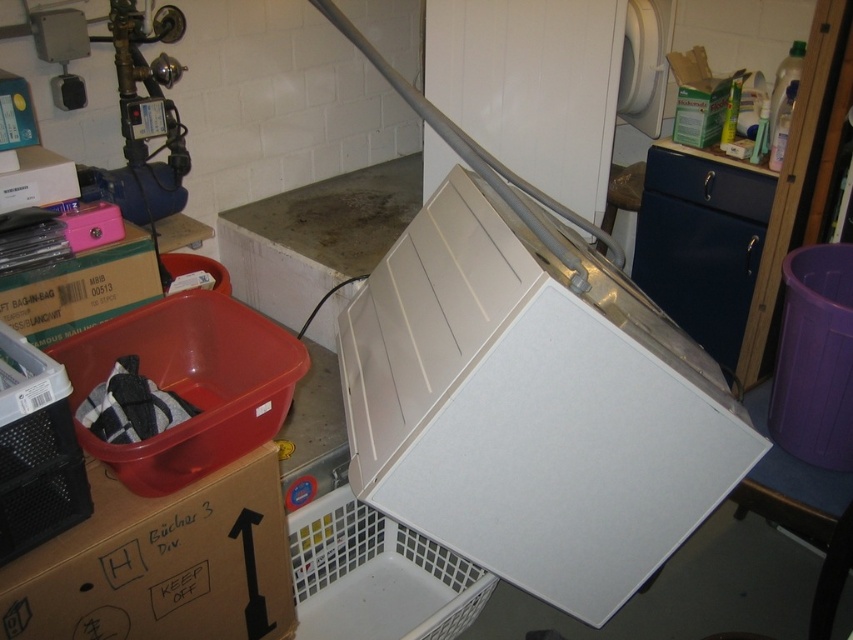
You are organizing items in the utility area and need to place a new item near the matte cardboard box at left. Where should you place it to ensure it stays within the same general area?

The matte cardboard box at left is located at point [80,289], so place the new item near those coordinates to stay within the same general area.

Consider the image. You are organizing items in a utility room and need to stack boxes. The matte cardboard box at left and the white cardboard box at upper left are both available. Which box should you choose if you want to place a taller item on top?

The matte cardboard box at left is much taller than the white cardboard box at upper left, so it would be more stable to place a taller item on top of the matte cardboard box at left.

You need to move a laundry basket from the white plastic basket at lower center to the white cardboard box at upper left. Given that the laundry basket is 0.5 meters wide, will it fit through the space between them?

The distance between the white plastic basket at lower center and the white cardboard box at upper left is 1.07 meters. Since the laundry basket is only 0.5 meters wide, it will easily fit through the space between them.